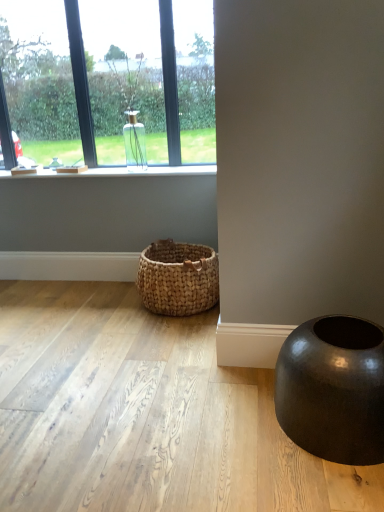
Question: Considering the relative sizes of shiny black vase at lower right and woven natural basket at lower center in the image provided, is shiny black vase at lower right thinner than woven natural basket at lower center?

Choices:
 (A) yes
 (B) no

Answer: (B)

Question: Is woven natural basket at lower center at the back of shiny black vase at lower right?

Choices:
 (A) no
 (B) yes

Answer: (A)

Question: Can you confirm if shiny black vase at lower right is taller than woven natural basket at lower center?

Choices:
 (A) yes
 (B) no

Answer: (B)

Question: Is shiny black vase at lower right to the right of woven natural basket at lower center from the viewer's perspective?

Choices:
 (A) no
 (B) yes

Answer: (B)

Question: Is shiny black vase at lower right at the left side of woven natural basket at lower center?

Choices:
 (A) yes
 (B) no

Answer: (B)

Question: From the image's perspective, is shiny black vase at lower right located above woven natural basket at lower center?

Choices:
 (A) yes
 (B) no

Answer: (B)

Question: Can you confirm if clear glass vase at upper left, which is the 1th window from left to right, is smaller than woven natural basket at lower center?

Choices:
 (A) no
 (B) yes

Answer: (A)

Question: Considering the relative sizes of clear glass vase at upper left, which is the 2th window in right-to-left order, and woven natural basket at lower center in the image provided, is clear glass vase at upper left, which is the 2th window in right-to-left order, wider than woven natural basket at lower center?

Choices:
 (A) yes
 (B) no

Answer: (B)

Question: From a real-world perspective, is clear glass vase at upper left, which is the 2th window in right-to-left order, beneath woven natural basket at lower center?

Choices:
 (A) no
 (B) yes

Answer: (A)

Question: Considering the relative positions of clear glass vase at upper left, which is the 1th window from left to right, and woven natural basket at lower center in the image provided, is clear glass vase at upper left, which is the 1th window from left to right, to the right of woven natural basket at lower center from the viewer's perspective?

Choices:
 (A) yes
 (B) no

Answer: (B)

Question: From the image's perspective, is clear glass vase at upper left, which is the 2th window in right-to-left order, above woven natural basket at lower center?

Choices:
 (A) yes
 (B) no

Answer: (A)

Question: Considering the relative sizes of clear glass vase at upper left, which is the 2th window in right-to-left order, and woven natural basket at lower center in the image provided, is clear glass vase at upper left, which is the 2th window in right-to-left order, shorter than woven natural basket at lower center?

Choices:
 (A) yes
 (B) no

Answer: (B)

Question: Is clear glass vase at upper left, the 2th window when ordered from left to right, turned away from shiny black vase at lower right?

Choices:
 (A) yes
 (B) no

Answer: (B)